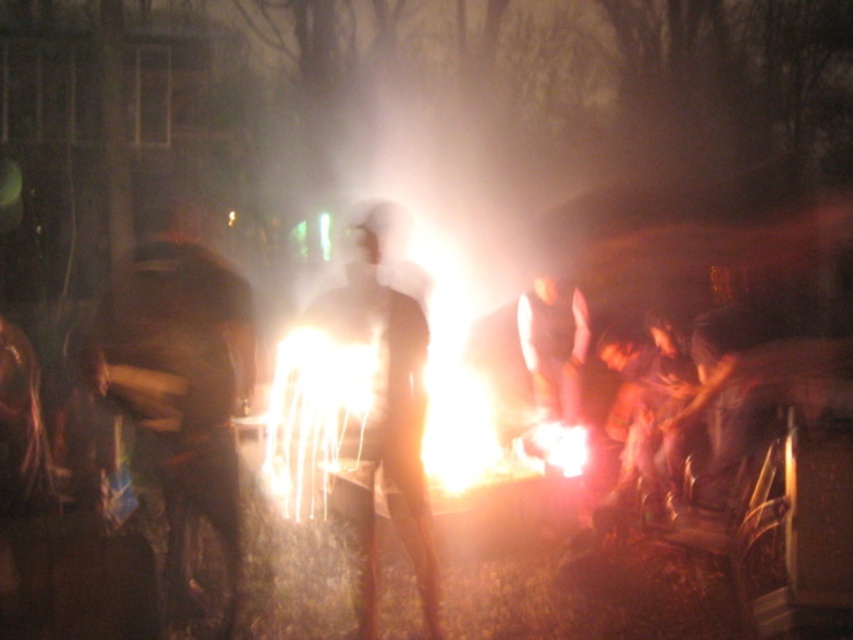
Between point (187, 337) and point (368, 216), which one is positioned in front?

Point (187, 337) is more forward.

Which is in front, point (169, 344) or point (361, 310)?

Point (169, 344)

The width and height of the screenshot is (853, 640). I want to click on dark brown leather jacket at left, so click(x=184, y=387).